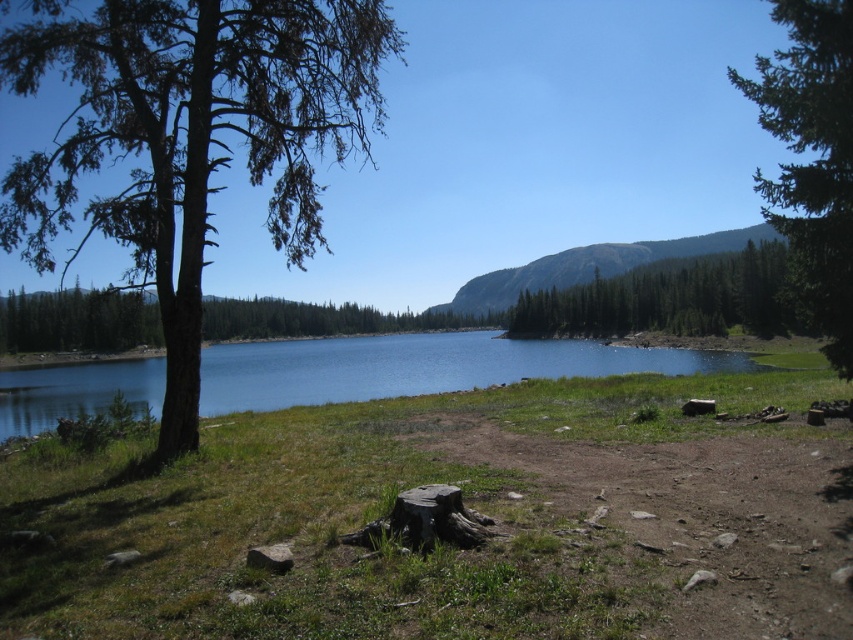
You are standing in the middle of the grassy area and want to walk towards the green textured tree at upper right. Which direction should you walk to avoid the green textured tree at left?

You should walk to the right to avoid the green textured tree at left and head towards the green textured tree at upper right since the green textured tree at left is located to the left of the green textured tree at upper right.